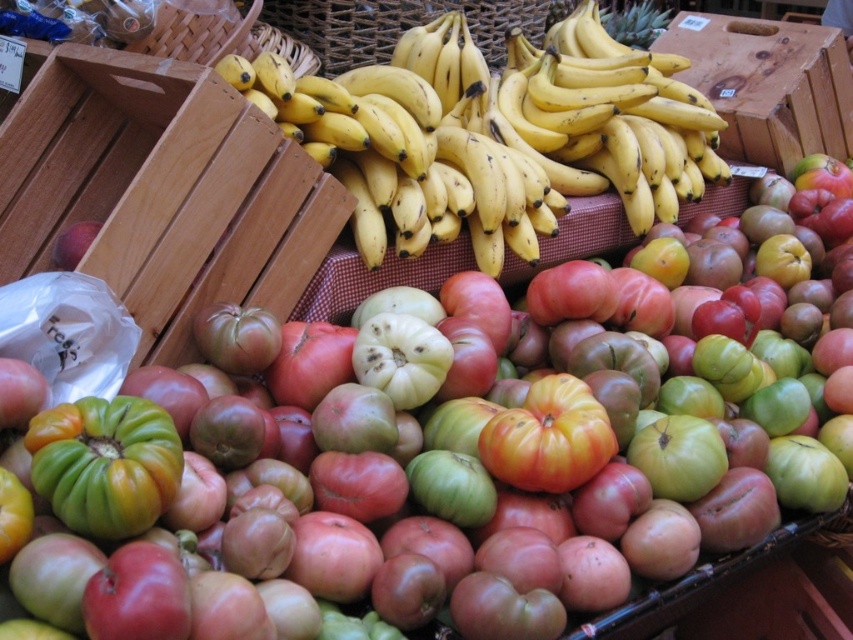
You are a customer at the market stall looking at the tomatoes and bananas. You notice two points marked in the image. Which point is closer to you, point [265,141] or point [531,467]?

Point [265,141] is closer to you than point [531,467] because it is further to the camera than the other point.

You are a customer at the market stall and want to grab the ripe red tomato at center. However, you notice a wooden crate at upper right blocking your path. Based on their positions, can you reach the tomato without moving the crate?

The wooden crate at upper right is to the right of the ripe red tomato at center, so you can still reach the ripe red tomato at center by approaching from the left side of the crate since the crate is not directly in front of it.

You are a customer at the market stall and want to grab the yellow matte bananas at center. However, you notice the wooden crate at upper right is in the way. Can you reach the bananas without moving the crate?

The yellow matte bananas at center is in front of the wooden crate at upper right, so you can reach the bananas without moving the crate because they are already positioned in front of it.